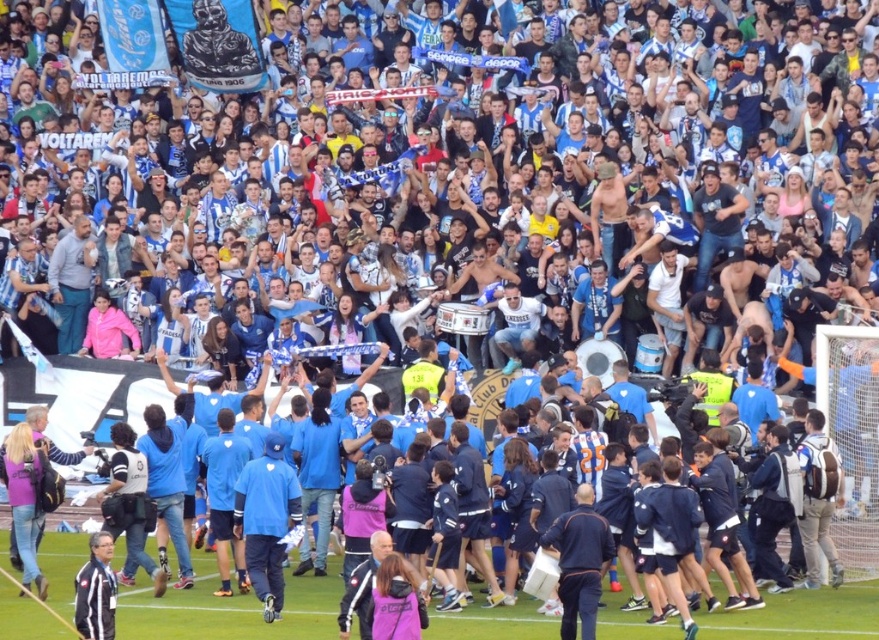
In the scene shown: You are a photographer standing at the center of the stadium, and you want to take a picture of the blue fabric jersey at center. Where should you point your camera to capture the point at coordinates (x=229, y=609)?

The point at coordinates (x=229, y=609) is located on the blue fabric jersey at center, so you should aim your camera directly at the blue fabric jersey at center to capture that point.

You are a photographer positioned at the edge of the field. You want to take a photo that includes both the blue fabric jersey at center and the green grass at lower center. Which object should you focus on first to ensure both are in frame?

Since the blue fabric jersey at center might be wider than green grass at lower center, you should focus on the blue fabric jersey at center first to ensure both objects fit within the frame.

You are standing in the stadium and want to throw a ball to the point marked at coordinates (747,612). Considering the distance, do you think you can reach it with a single throw?

The point at coordinates (747,612) is 63.38 meters away from you, so you cannot reach it with a single throw as the distance is too far.